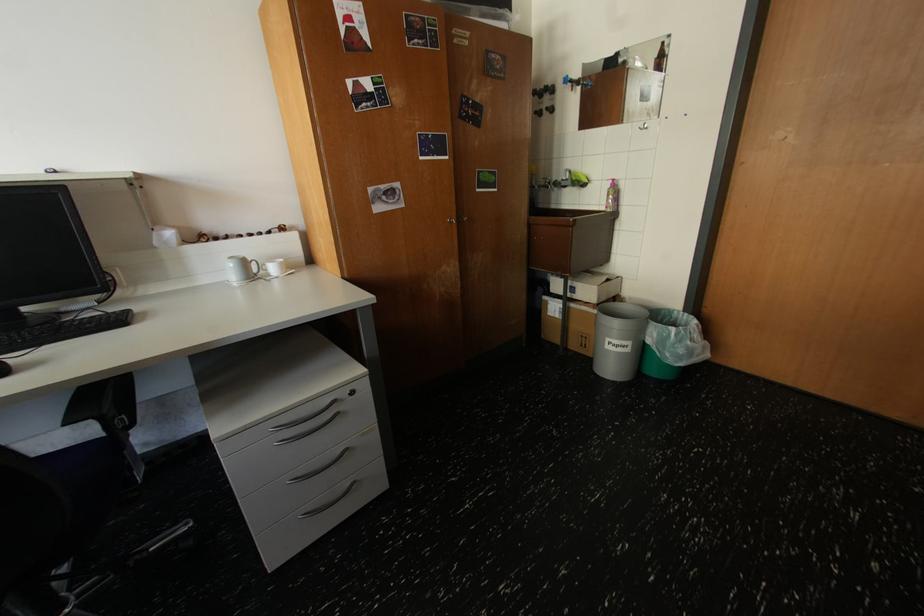
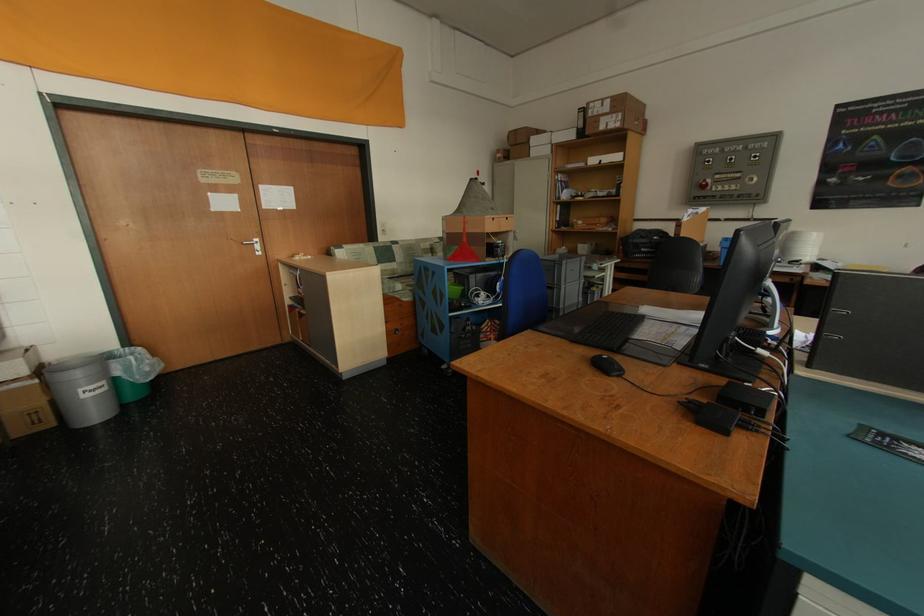
The point at (x=594, y=347) is marked in the first image. Where is the corresponding point in the second image?

(50, 422)